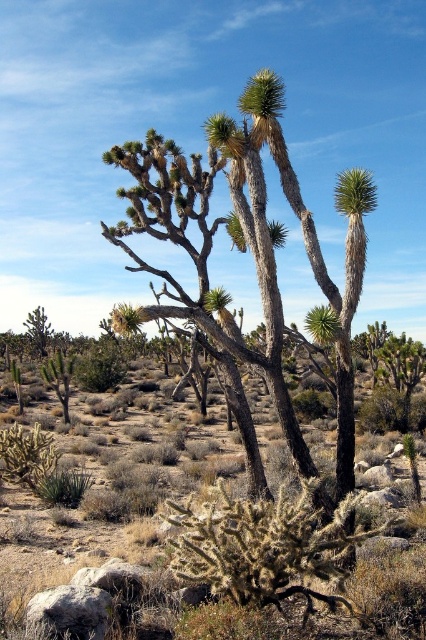
Question: Can you confirm if brown spiny cactus at center is positioned below brown textured cactus at center?

Choices:
 (A) yes
 (B) no

Answer: (A)

Question: Does brown spiny cactus at center come behind brown textured cactus at center?

Choices:
 (A) no
 (B) yes

Answer: (A)

Question: Which of the following is the closest to the observer?

Choices:
 (A) (129, 268)
 (B) (365, 545)

Answer: (B)

Question: Is brown spiny cactus at center below brown textured cactus at center?

Choices:
 (A) yes
 (B) no

Answer: (A)

Question: Among these objects, which one is nearest to the camera?

Choices:
 (A) brown spiny cactus at center
 (B) brown textured cactus at center

Answer: (A)